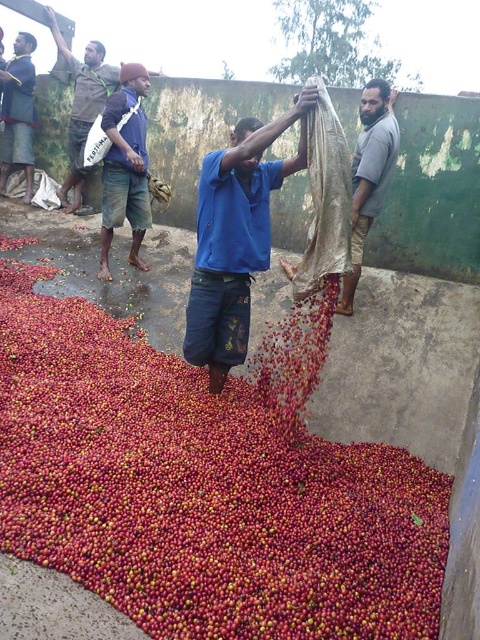
You are standing at the origin point of the image. Which object is located at the coordinates point (370, 173)?

The point (370, 173) is located on the gray cotton shirt at upper right.

You are standing in the scene and want to place a small marker at each of the two points, point (321, 595) and point (197, 273). Which point should you place the marker closer to you?

Point (321, 595) is closer to the viewer than point (197, 273), so you should place the marker closer to point (321, 595).